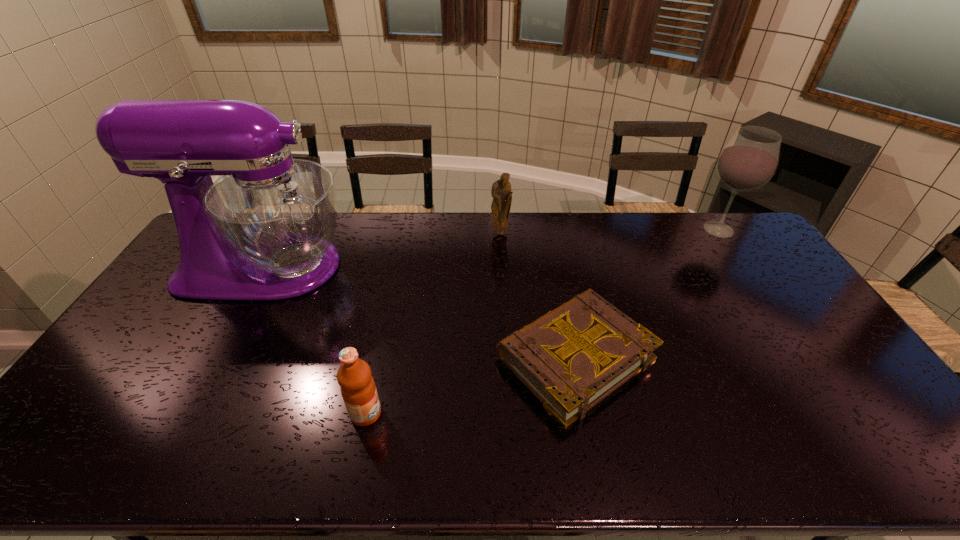
Where is `free space at the near edge`? Image resolution: width=960 pixels, height=540 pixels. free space at the near edge is located at coordinates (773, 459).

Image resolution: width=960 pixels, height=540 pixels. What are the coordinates of `vacant space at the left edge` in the screenshot? It's located at (173, 296).

The width and height of the screenshot is (960, 540). What are the coordinates of `free region at the right edge of the desktop` in the screenshot? It's located at (810, 387).

At what (x,y) coordinates should I click in order to perform the action: click on empty location between the mixer and the hardback book. Please return your answer as a coordinate pair (x, y). The height and width of the screenshot is (540, 960). Looking at the image, I should click on (420, 313).

The image size is (960, 540). I want to click on vacant area that lies between the fruit juice and the hardback book, so click(470, 386).

The image size is (960, 540). I want to click on free space between the shortest object and the fruit juice, so click(x=470, y=386).

Image resolution: width=960 pixels, height=540 pixels. What are the coordinates of `free space between the fourth shortest object and the figurine` in the screenshot? It's located at (610, 232).

Where is `vacant space in between the rightmost object and the shortest object`? Image resolution: width=960 pixels, height=540 pixels. vacant space in between the rightmost object and the shortest object is located at coordinates point(647,294).

Find the location of a particular element. free space that is in between the hardback book and the figurine is located at coordinates (538, 295).

Image resolution: width=960 pixels, height=540 pixels. I want to click on empty space between the fruit juice and the mixer, so tap(316, 340).